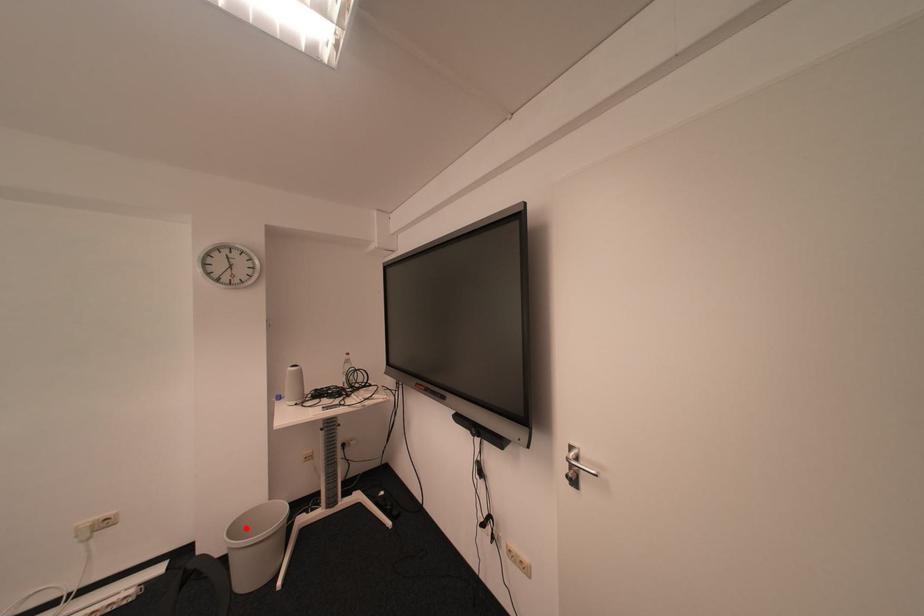
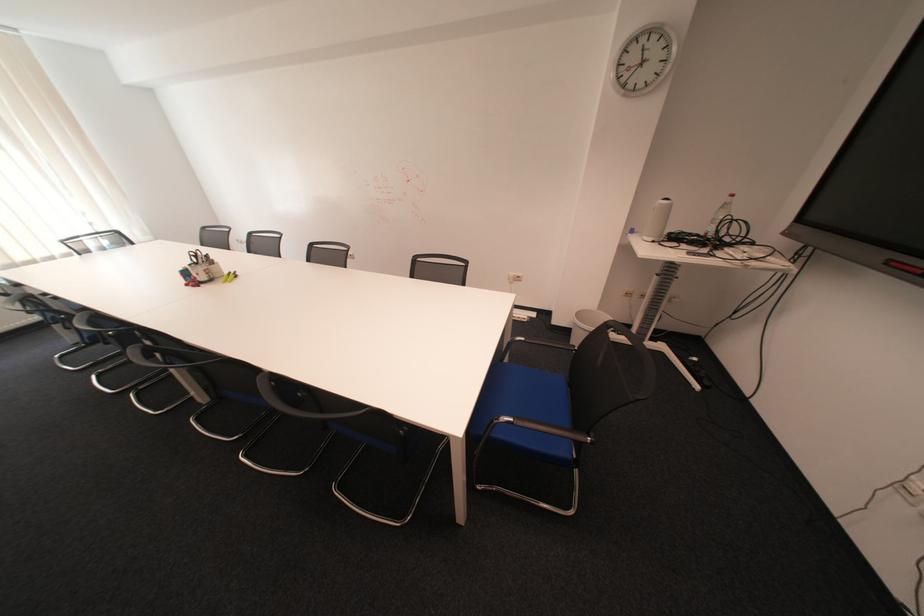
Find the pixel in the second image that matches the highlighted location in the first image.

(590, 315)